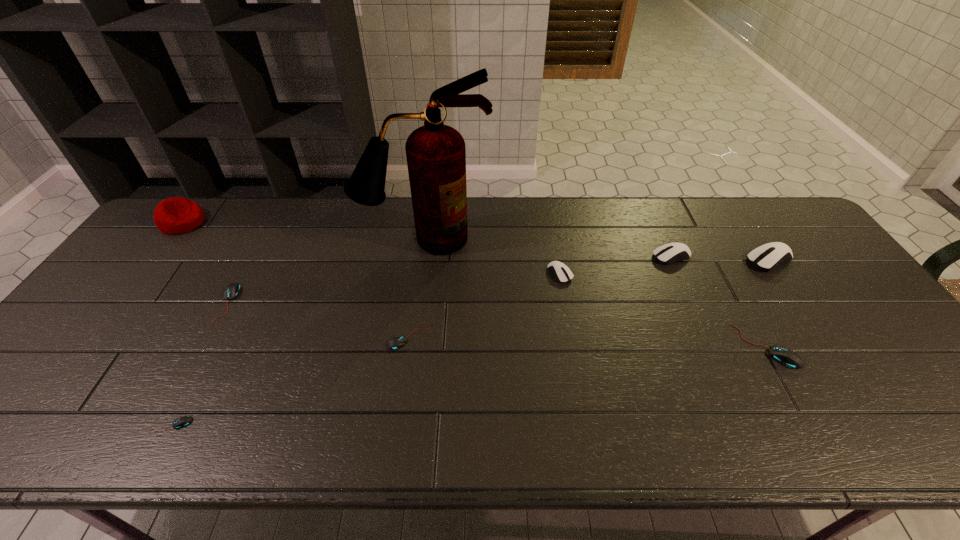
I want to click on vacant space that satisfies the following two spatial constraints: 1. on the seat area of the leftmost object; 2. on the left side of the sixth shortest object, so click(x=156, y=256).

The width and height of the screenshot is (960, 540). In order to click on free location that satisfies the following two spatial constraints: 1. on the back side of the fifth tallest mouse; 2. on the left side of the second tallest mouse in this screenshot , I will do `click(252, 256)`.